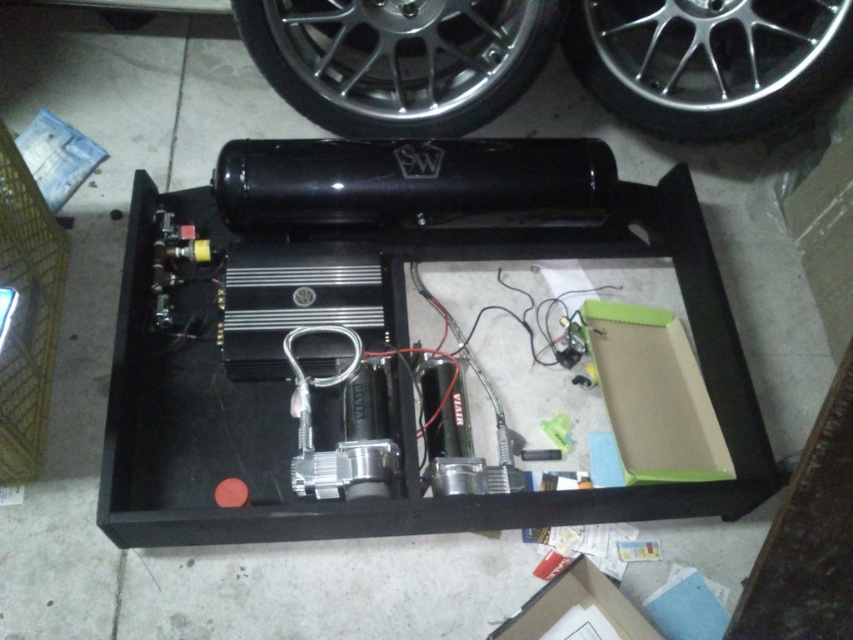
Question: Can you confirm if silver metallic wheel at upper center is positioned above chrome metallic wheel at upper center?

Choices:
 (A) yes
 (B) no

Answer: (B)

Question: Does silver metallic wheel at upper center appear on the right side of chrome metallic wheel at upper center?

Choices:
 (A) no
 (B) yes

Answer: (A)

Question: Among these points, which one is farthest from the camera?

Choices:
 (A) [x=437, y=20]
 (B) [x=711, y=138]

Answer: (B)

Question: Among these points, which one is farthest from the camera?

Choices:
 (A) (370, 92)
 (B) (837, 0)

Answer: (A)

Question: Among these points, which one is nearest to the camera?

Choices:
 (A) (840, 77)
 (B) (300, 17)

Answer: (B)

Question: Does silver metallic wheel at upper center appear over chrome metallic wheel at upper center?

Choices:
 (A) yes
 (B) no

Answer: (B)